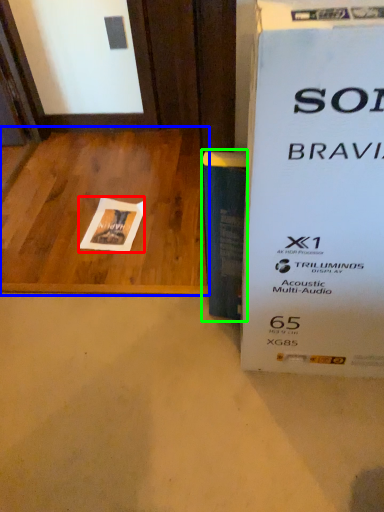
Question: Based on their relative distances, which object is nearer to flyer (highlighted by a red box)? Choose from table (highlighted by a blue box) and paperback book (highlighted by a green box).

Choices:
 (A) table
 (B) paperback book

Answer: (A)